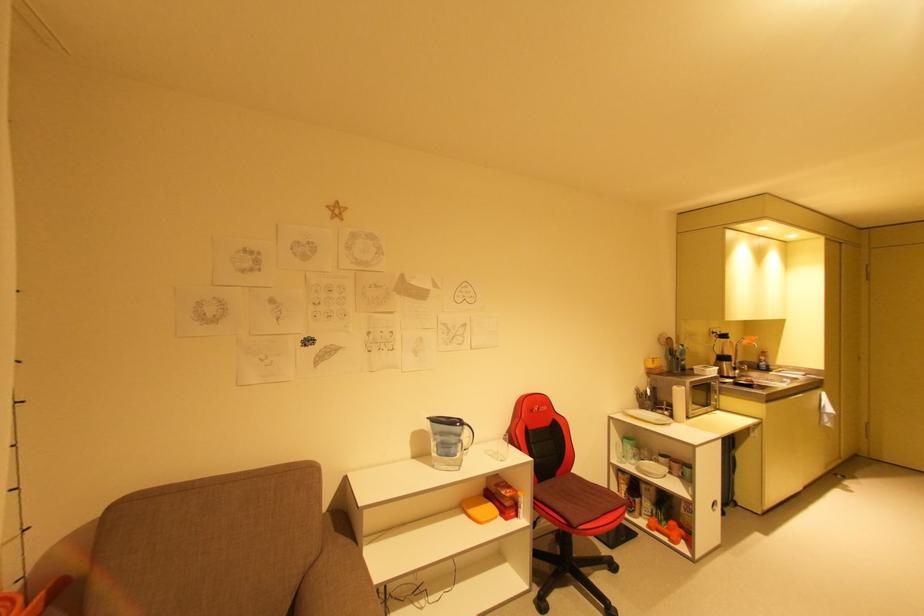
The image size is (924, 616). I want to click on black kettle handle, so click(x=448, y=440).